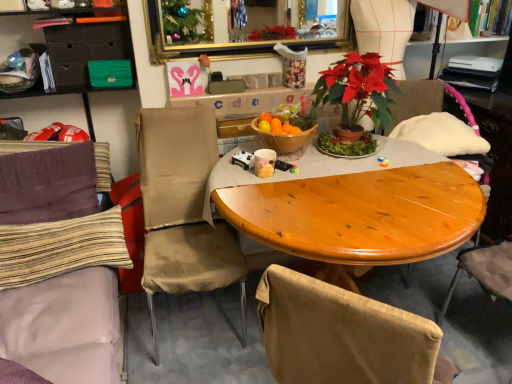
Question: Is wooden armchair at right thinner than gold-framed mirror at upper center?

Choices:
 (A) yes
 (B) no

Answer: (B)

Question: Is wooden armchair at right aimed at gold-framed mirror at upper center?

Choices:
 (A) no
 (B) yes

Answer: (A)

Question: Is wooden armchair at right next to gold-framed mirror at upper center and touching it?

Choices:
 (A) yes
 (B) no

Answer: (B)

Question: From a real-world perspective, is wooden armchair at right on gold-framed mirror at upper center?

Choices:
 (A) no
 (B) yes

Answer: (A)

Question: Is wooden armchair at right oriented away from gold-framed mirror at upper center?

Choices:
 (A) yes
 (B) no

Answer: (B)

Question: In the image, is wooden bowl at center on the left side or the right side of gold-framed mirror at upper center?

Choices:
 (A) right
 (B) left

Answer: (A)

Question: In the image, is wooden bowl at center positioned in front of or behind gold-framed mirror at upper center?

Choices:
 (A) front
 (B) behind

Answer: (A)

Question: Do you think wooden bowl at center is within gold-framed mirror at upper center, or outside of it?

Choices:
 (A) inside
 (B) outside

Answer: (B)

Question: Looking at the image, does wooden bowl at center seem bigger or smaller compared to gold-framed mirror at upper center?

Choices:
 (A) big
 (B) small

Answer: (B)

Question: From a real-world perspective, is purple knit fabric at left, positioned as the 1th chair in left-to-right order, above or below purple knitted pillow at left, the first pillow when ordered from top to bottom?

Choices:
 (A) above
 (B) below

Answer: (B)

Question: In terms of height, does purple knit fabric at left, positioned as the 1th chair in left-to-right order, look taller or shorter compared to purple knitted pillow at left, which ranks as the 2th pillow in bottom-to-top order?

Choices:
 (A) tall
 (B) short

Answer: (A)

Question: From the image's perspective, is purple knit fabric at left, positioned as the 1th chair in left-to-right order, above or below purple knitted pillow at left, the first pillow when ordered from top to bottom?

Choices:
 (A) above
 (B) below

Answer: (B)

Question: Which is correct: purple knit fabric at left, positioned as the 1th chair in left-to-right order, is inside purple knitted pillow at left, which ranks as the 2th pillow in bottom-to-top order, or outside of it?

Choices:
 (A) outside
 (B) inside

Answer: (A)

Question: Considering their positions, is striped fabric pillow at left, the first pillow from the bottom, located in front of or behind purple knit fabric at left, positioned as the 1th chair in left-to-right order?

Choices:
 (A) behind
 (B) front

Answer: (A)

Question: Looking at their shapes, would you say striped fabric pillow at left, the first pillow from the bottom, is wider or thinner than purple knit fabric at left, marked as the 2th chair in a right-to-left arrangement?

Choices:
 (A) wide
 (B) thin

Answer: (B)